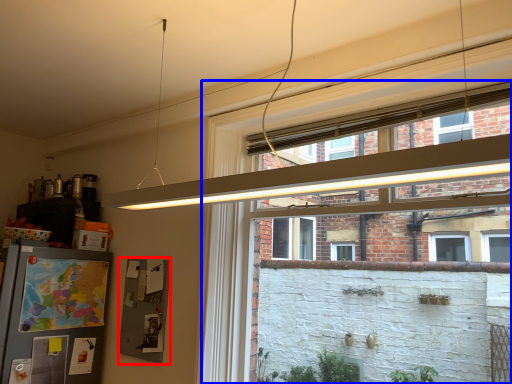
Question: Which object appears closest to the camera in this image, bulletin board (highlighted by a red box) or window (highlighted by a blue box)?

Choices:
 (A) bulletin board
 (B) window

Answer: (B)